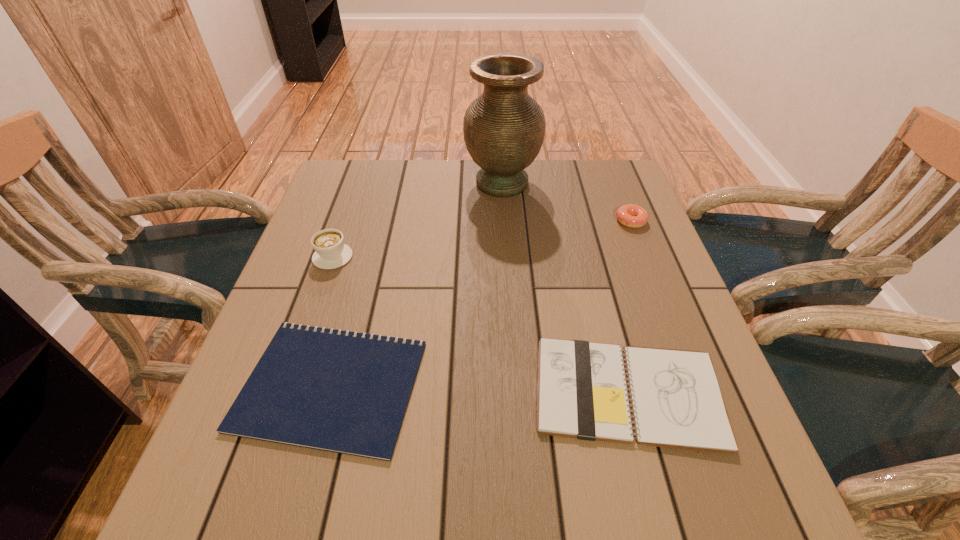
Find the location of a particular element. free location located on the left of the tallest object is located at coordinates (360, 183).

Locate an element on the screen. The width and height of the screenshot is (960, 540). free space located 0.370m to the right of the third nearest object's handle is located at coordinates (365, 165).

You are a GUI agent. You are given a task and a screenshot of the screen. Output one action in this format:
    pyautogui.click(x=<x>, y=<y>)
    Task: Click on the free spot located to the right of the third nearest object's handle
    The height and width of the screenshot is (540, 960).
    Given the screenshot: What is the action you would take?
    pyautogui.click(x=349, y=210)

Where is `vacant region located 0.070m to the right of the third nearest object's handle`? Image resolution: width=960 pixels, height=540 pixels. vacant region located 0.070m to the right of the third nearest object's handle is located at coordinates (344, 226).

Locate an element on the screen. free spot located on the back of the third tallest object is located at coordinates (617, 187).

This screenshot has width=960, height=540. I want to click on free location located on the back of the fourth tallest object, so click(582, 220).

Where is `vacant space located on the right of the left notepad`? The width and height of the screenshot is (960, 540). vacant space located on the right of the left notepad is located at coordinates (529, 385).

Find the location of a particular element. object that is at the far edge is located at coordinates (504, 128).

Identify the location of cappuccino at the left edge. Image resolution: width=960 pixels, height=540 pixels. (330, 252).

At what (x,y) coordinates should I click in order to perform the action: click on notepad that is at the left edge. Please return your answer as a coordinate pair (x, y). The width and height of the screenshot is (960, 540). Looking at the image, I should click on (332, 390).